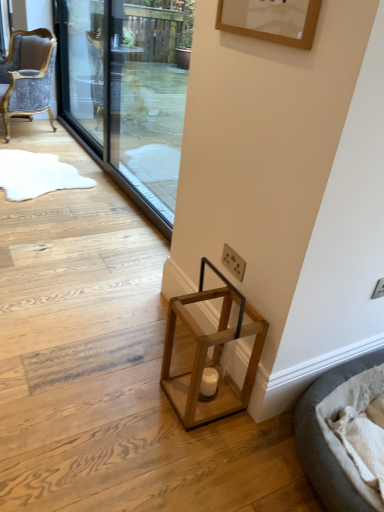
Question: In terms of width, does transparent glass screen door at upper center, positioned as the first screen door in right-to-left order, look wider or thinner when compared to wooden lantern at lower center?

Choices:
 (A) thin
 (B) wide

Answer: (B)

Question: From the image's perspective, is transparent glass screen door at upper center, which is counted as the 2th screen door, starting from the left, positioned above or below wooden lantern at lower center?

Choices:
 (A) below
 (B) above

Answer: (B)

Question: Considering the real-world distances, which object is farthest from the wooden lantern at lower center?

Choices:
 (A) soft gray fabric cat bed at lower right
 (B) velvet grey chair at left
 (C) transparent glass screen door at upper center, positioned as the first screen door in right-to-left order
 (D) transparent glass screen door at upper left, which is the second screen door from right to left

Answer: (B)

Question: Based on their relative distances, which object is farther from the velvet grey chair at left?

Choices:
 (A) transparent glass screen door at upper left, the first screen door viewed from the left
 (B) wooden lantern at lower center
 (C) transparent glass screen door at upper center, positioned as the first screen door in right-to-left order
 (D) soft gray fabric cat bed at lower right

Answer: (D)